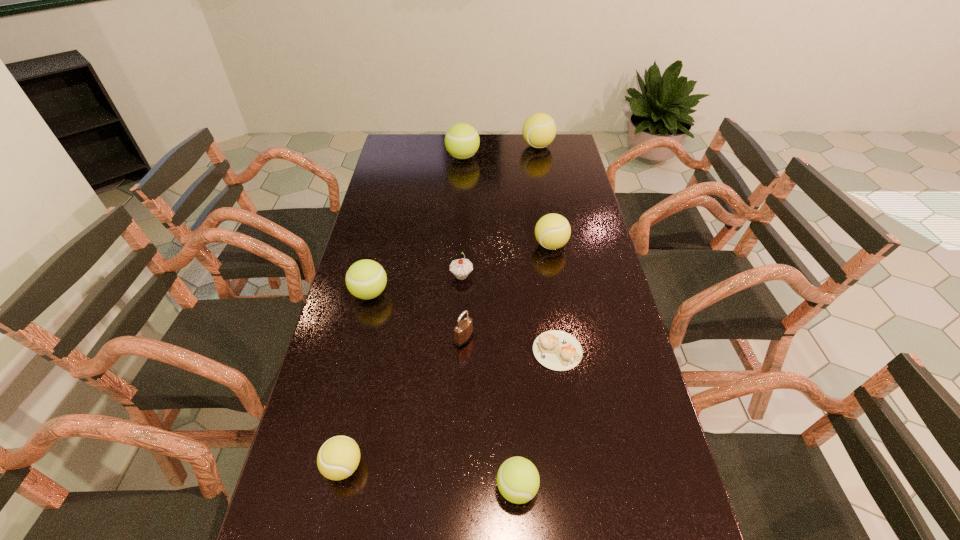
Identify the location of empty space that is in between the second nearest yellow tennis ball and the fourth object from right to left. This screenshot has width=960, height=540. (534, 367).

Identify the location of object that can be found as the seventh closest to the cappuccino. (462, 141).

Choose which object is the eighth nearest neighbor to the gray cupcake. Please provide its 2D coordinates. Your answer should be formatted as a tuple, i.e. [(x, y)], where the tuple contains the x and y coordinates of a point satisfying the conditions above.

[(539, 130)]

Identify which tennis ball is the fourth closest to the farthest green tennis ball. Please provide its 2D coordinates. Your answer should be formatted as a tuple, i.e. [(x, y)], where the tuple contains the x and y coordinates of a point satisfying the conditions above.

[(337, 459)]

You are a GUI agent. You are given a task and a screenshot of the screen. Output one action in this format:
    pyautogui.click(x=<x>, y=<y>)
    Task: Click on the tennis ball that can be found as the second closest to the second farthest yellow tennis ball
    This screenshot has height=540, width=960.
    Given the screenshot: What is the action you would take?
    pyautogui.click(x=462, y=141)

Identify which yellow tennis ball is located as the second nearest to the third tennis ball from right to left. Please provide its 2D coordinates. Your answer should be formatted as a tuple, i.e. [(x, y)], where the tuple contains the x and y coordinates of a point satisfying the conditions above.

[(552, 231)]

Find the location of a particular element. yellow tennis ball that stands as the closest to the third nearest tennis ball is located at coordinates (337, 459).

Find the location of a particular element. This screenshot has height=540, width=960. the second closest green tennis ball relative to the third tennis ball from left to right is located at coordinates (518, 480).

Identify which green tennis ball is the second nearest to the smallest yellow tennis ball. Please provide its 2D coordinates. Your answer should be formatted as a tuple, i.e. [(x, y)], where the tuple contains the x and y coordinates of a point satisfying the conditions above.

[(366, 279)]

Where is `blank space that satisfies the following two spatial constraints: 1. on the front side of the leftmost yellow tennis ball; 2. on the left side of the second smallest green tennis ball`? blank space that satisfies the following two spatial constraints: 1. on the front side of the leftmost yellow tennis ball; 2. on the left side of the second smallest green tennis ball is located at coordinates (328, 466).